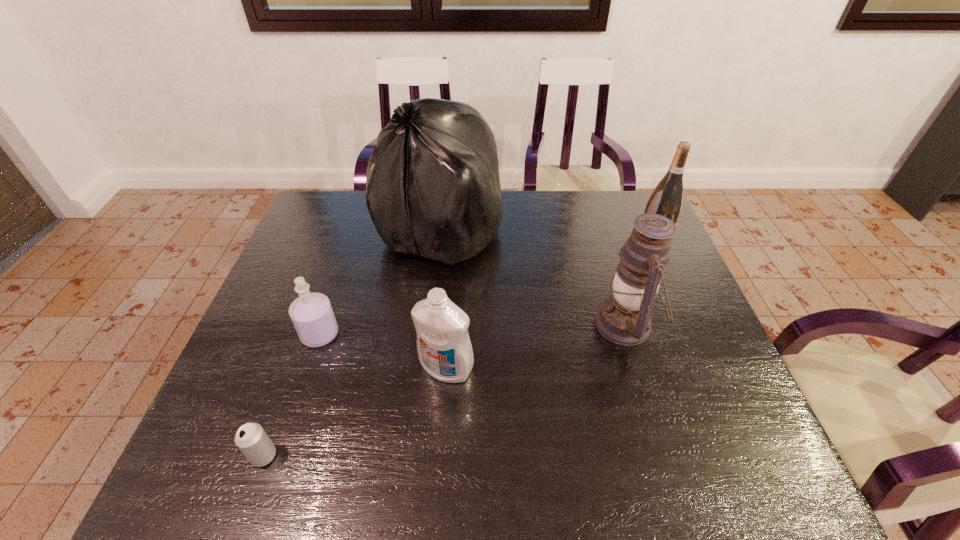
What are the coordinates of `the tallest object` in the screenshot? It's located at (434, 190).

Locate an element on the screen. the rightmost object is located at coordinates (667, 198).

Locate an element on the screen. Image resolution: width=960 pixels, height=540 pixels. oil lamp is located at coordinates (624, 318).

Where is `detergent`? The height and width of the screenshot is (540, 960). detergent is located at coordinates (445, 352).

The image size is (960, 540). I want to click on the fifth tallest object, so click(311, 313).

Identify the location of the nearest object. The image size is (960, 540). (252, 440).

Find the location of a particular element. This screenshot has height=540, width=960. the shortest object is located at coordinates (252, 440).

At what (x,y) coordinates should I click in order to perform the action: click on free space located on the right of the tallest object. Please return your answer as a coordinate pair (x, y). The image size is (960, 540). Looking at the image, I should click on (620, 230).

Where is `blank space located on the label of the wine bottle`? The width and height of the screenshot is (960, 540). blank space located on the label of the wine bottle is located at coordinates (593, 244).

I want to click on free region located 0.130m on the label of the wine bottle, so click(x=593, y=244).